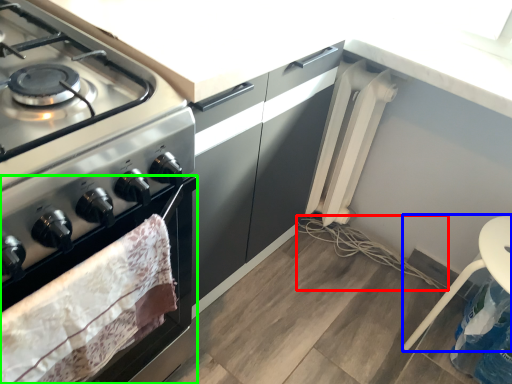
Question: Which object is positioned farthest from string (highlighted by a red box)? Select from chair (highlighted by a blue box) and oven (highlighted by a green box).

Choices:
 (A) chair
 (B) oven

Answer: (B)